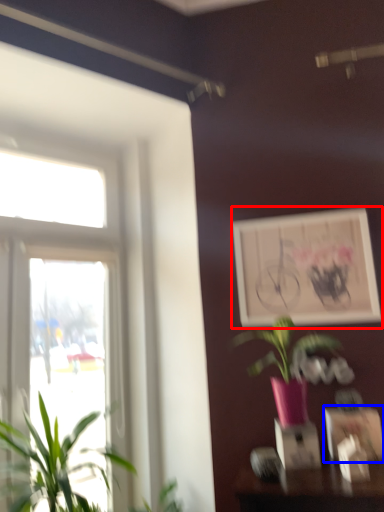
Question: Which object is further to the camera taking this photo, picture frame (highlighted by a red box) or picture frame (highlighted by a blue box)?

Choices:
 (A) picture frame
 (B) picture frame

Answer: (A)